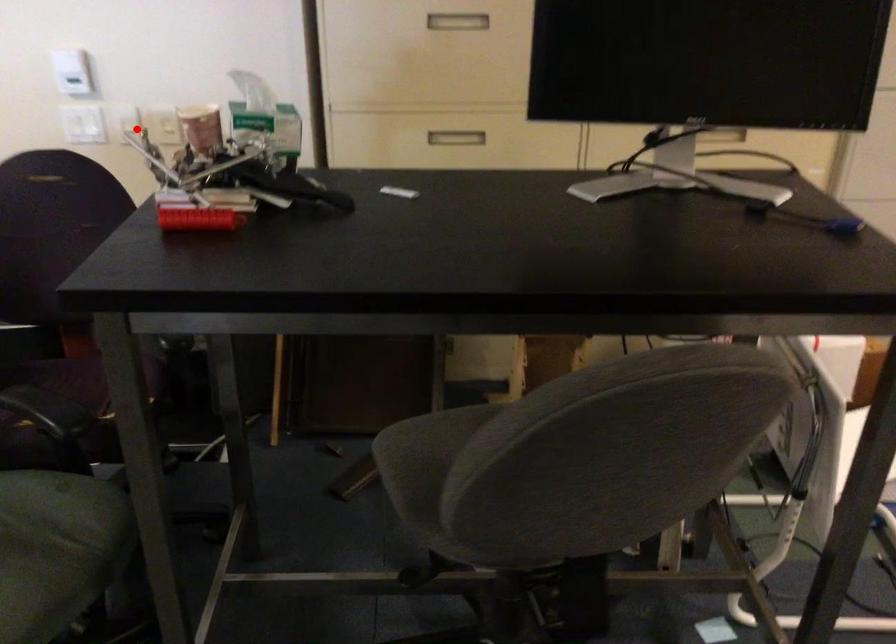
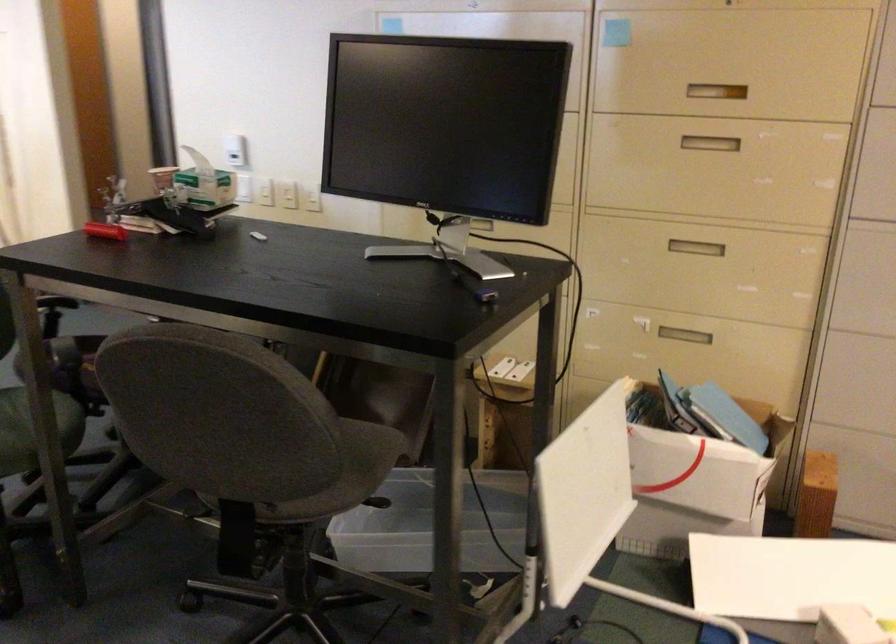
Question: I am providing you with two images of the same scene from different viewpoints. A red point is shown in image1. For the corresponding object point in image2, is it positioned nearer or farther from the camera?

Choices:
 (A) Nearer
 (B) Farther

Answer: (B)